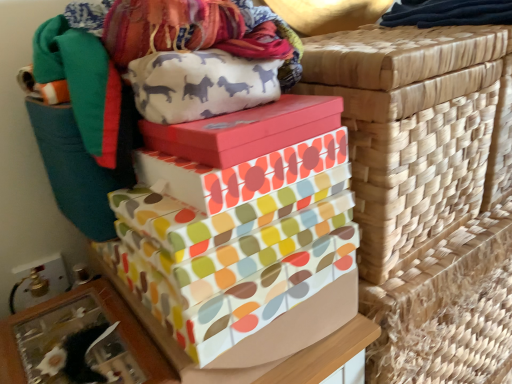
Question: Considering the relative sizes of matte pink box at center, placed as the third gift box when sorted from bottom to top, and multicolored fabric gift box at center, the 2th gift box viewed from the top, in the image provided, is matte pink box at center, placed as the third gift box when sorted from bottom to top, thinner than multicolored fabric gift box at center, the 2th gift box viewed from the top,?

Choices:
 (A) no
 (B) yes

Answer: (B)

Question: Is matte pink box at center, placed as the third gift box when sorted from bottom to top, directly adjacent to multicolored fabric gift box at center, the second gift box from the bottom?

Choices:
 (A) yes
 (B) no

Answer: (A)

Question: From a real-world perspective, does matte pink box at center, placed as the third gift box when sorted from bottom to top, sit lower than multicolored fabric gift box at center, the second gift box from the bottom?

Choices:
 (A) yes
 (B) no

Answer: (B)

Question: Is matte pink box at center, placed as the first gift box when sorted from top to bottom, at the right side of multicolored fabric gift box at center, the second gift box from the bottom?

Choices:
 (A) yes
 (B) no

Answer: (A)

Question: Can you confirm if matte pink box at center, placed as the first gift box when sorted from top to bottom, is positioned to the left of multicolored fabric gift box at center, the second gift box from the bottom?

Choices:
 (A) no
 (B) yes

Answer: (A)

Question: In the image, is multicolored paper gift boxes at center, acting as the third gift box starting from the top, positioned in front of or behind multicolored fabric gift box at center, the second gift box from the bottom?

Choices:
 (A) front
 (B) behind

Answer: (A)

Question: Looking at their shapes, would you say multicolored paper gift boxes at center, the 1th gift box from the bottom, is wider or thinner than multicolored fabric gift box at center, the second gift box from the bottom?

Choices:
 (A) thin
 (B) wide

Answer: (B)

Question: In terms of height, does multicolored paper gift boxes at center, the 1th gift box from the bottom, look taller or shorter compared to multicolored fabric gift box at center, the 2th gift box viewed from the top?

Choices:
 (A) short
 (B) tall

Answer: (B)

Question: Looking at the image, does multicolored paper gift boxes at center, acting as the third gift box starting from the top, seem bigger or smaller compared to multicolored fabric gift box at center, the second gift box from the bottom?

Choices:
 (A) big
 (B) small

Answer: (A)

Question: Is point (344, 54) closer or farther from the camera than point (187, 29)?

Choices:
 (A) farther
 (B) closer

Answer: (A)

Question: Is woven straw basket at upper right bigger or smaller than multicolored woven fabric at upper left?

Choices:
 (A) small
 (B) big

Answer: (B)

Question: Based on their positions, is woven straw basket at upper right located to the left or right of multicolored woven fabric at upper left?

Choices:
 (A) right
 (B) left

Answer: (A)

Question: Considering their positions, is woven straw basket at upper right located in front of or behind multicolored woven fabric at upper left?

Choices:
 (A) front
 (B) behind

Answer: (B)

Question: From the image's perspective, is multicolored fabric gift box at center, the second gift box from the bottom, located above or below woven straw basket at upper right?

Choices:
 (A) above
 (B) below

Answer: (B)

Question: From a real-world perspective, is multicolored fabric gift box at center, the 2th gift box viewed from the top, positioned above or below woven straw basket at upper right?

Choices:
 (A) above
 (B) below

Answer: (A)